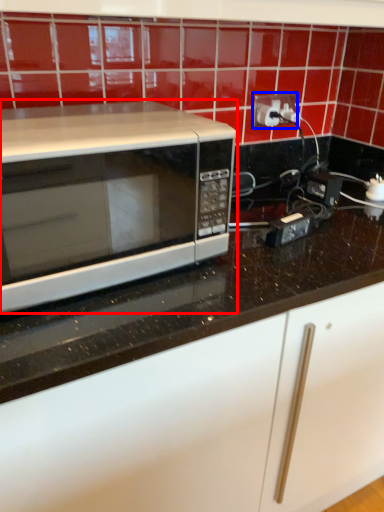
Question: Which of the following is the closest to the observer, microwave oven (highlighted by a red box) or electric outlet (highlighted by a blue box)?

Choices:
 (A) microwave oven
 (B) electric outlet

Answer: (A)